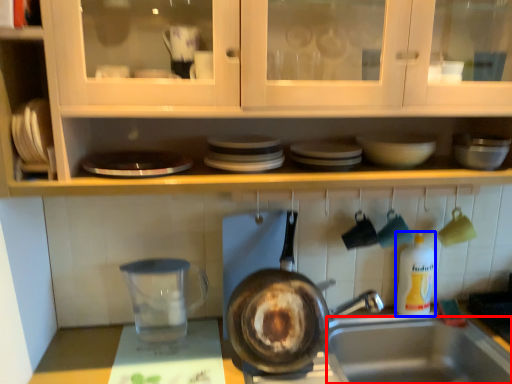
Question: Which point is closer to the camera, sink (highlighted by a red box) or bottle (highlighted by a blue box)?

Choices:
 (A) sink
 (B) bottle

Answer: (A)